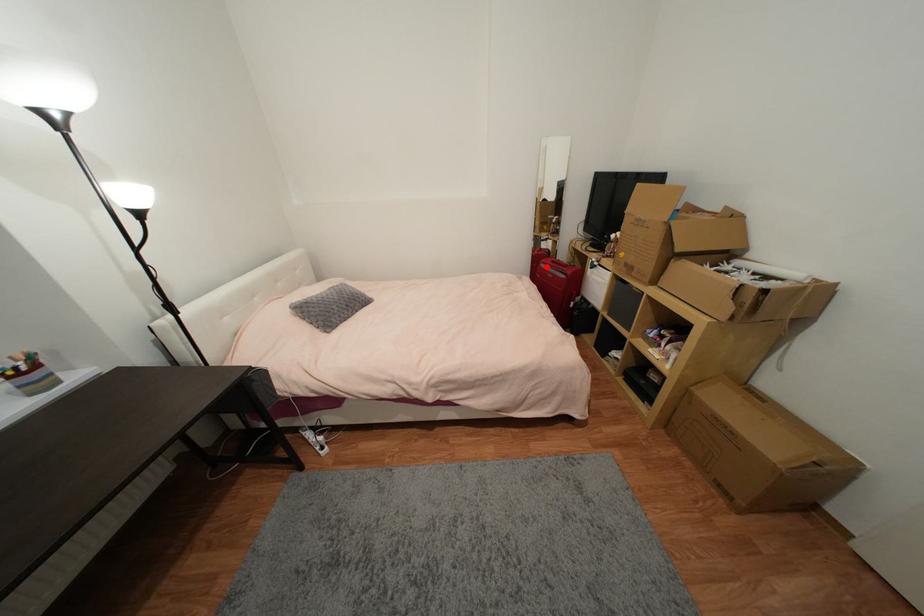
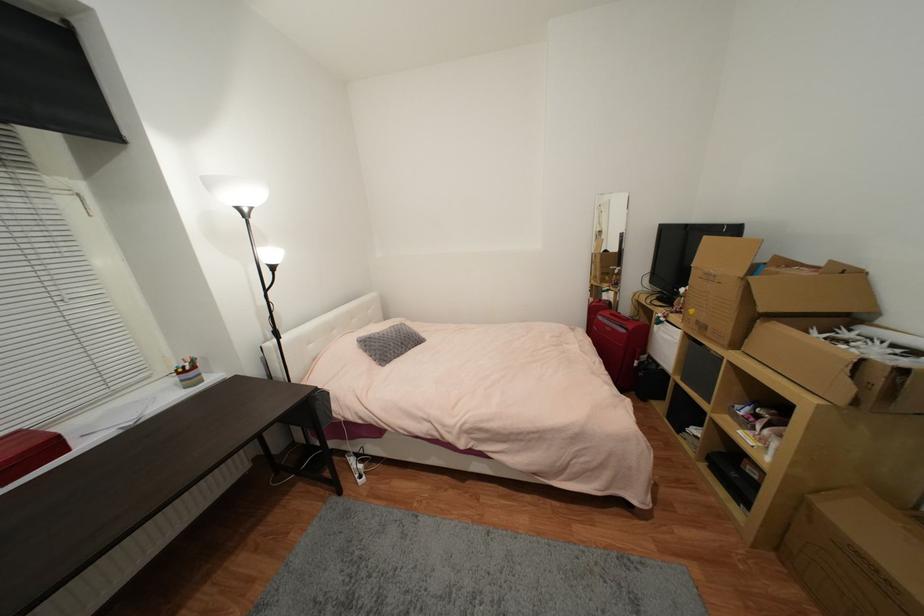
Question: I am providing you with two images of the same scene from different viewpoints. Image1 has a red point marked. In image2, the corresponding 3D location appears at what relative position? Reply with the corresponding letter.

Choices:
 (A) Closer
 (B) Farther

Answer: (B)